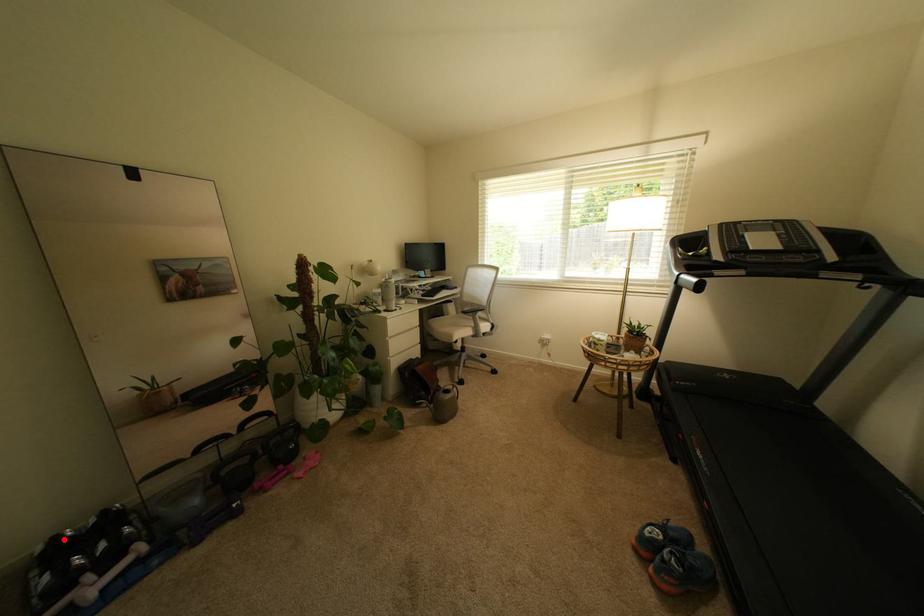
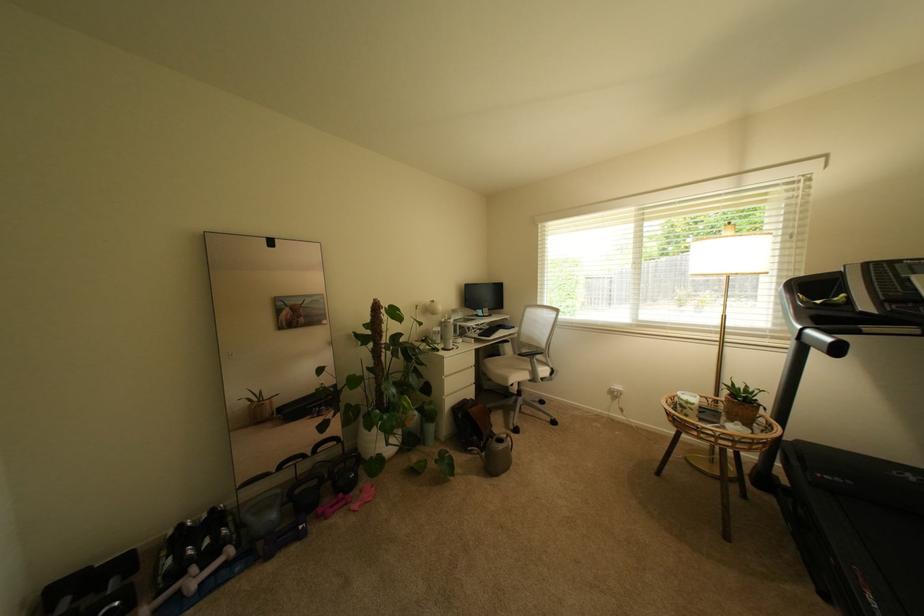
Question: A red point is marked in image1. In image2, is the corresponding 3D point closer to the camera or farther? Reply with the corresponding letter.

Choices:
 (A) The corresponding 3D point is closer.
 (B) The corresponding 3D point is farther.

Answer: (B)